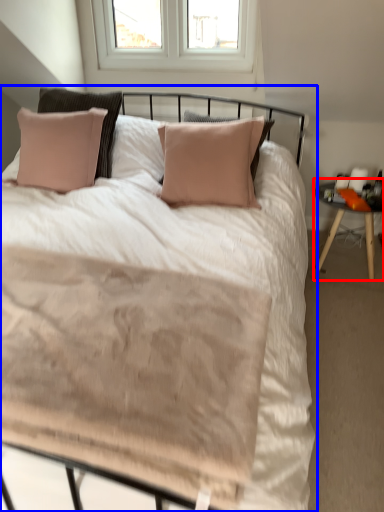
Question: Among these objects, which one is nearest to the camera, nightstand (highlighted by a red box) or bed (highlighted by a blue box)?

Choices:
 (A) nightstand
 (B) bed

Answer: (B)